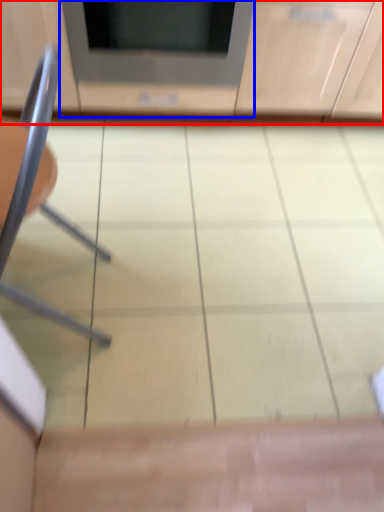
Question: Among these objects, which one is farthest to the camera, cabinetry (highlighted by a red box) or appliance (highlighted by a blue box)?

Choices:
 (A) cabinetry
 (B) appliance

Answer: (B)